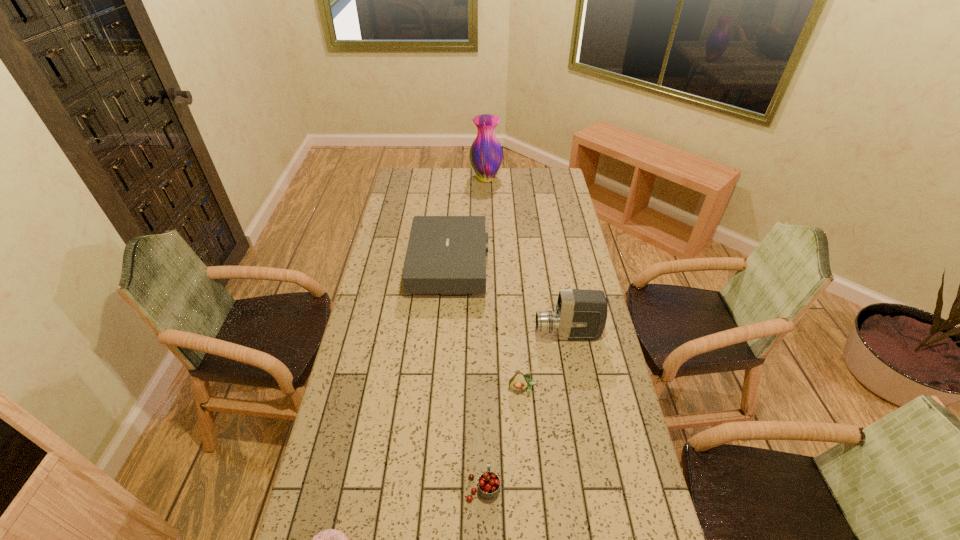
I want to click on free space located 0.250m at the front of the camcorder, highlighting the lens, so click(467, 335).

The height and width of the screenshot is (540, 960). What are the coordinates of `vacant space located at the front of the camcorder, highlighting the lens` in the screenshot? It's located at [x=478, y=335].

Locate an element on the screen. The image size is (960, 540). blank area located 0.350m on the front-facing side of the fourth shortest object is located at coordinates (569, 266).

This screenshot has height=540, width=960. What are the coordinates of `vacant area located 0.400m on the seed side of the third nearest object` in the screenshot? It's located at (535, 531).

In order to click on free space located on the handle side of the second nearest object in this screenshot , I will do `click(483, 394)`.

This screenshot has width=960, height=540. Find the location of `vacant space situated on the handle side of the second nearest object`. vacant space situated on the handle side of the second nearest object is located at coordinates (483, 391).

The image size is (960, 540). What are the coordinates of `free space located on the handle side of the second nearest object` in the screenshot? It's located at (483, 396).

Where is `object situated at the far edge`? This screenshot has width=960, height=540. object situated at the far edge is located at coordinates (486, 154).

This screenshot has width=960, height=540. I want to click on object at the right edge, so click(x=580, y=315).

This screenshot has height=540, width=960. In order to click on free space at the far edge of the desktop in this screenshot , I will do `click(435, 187)`.